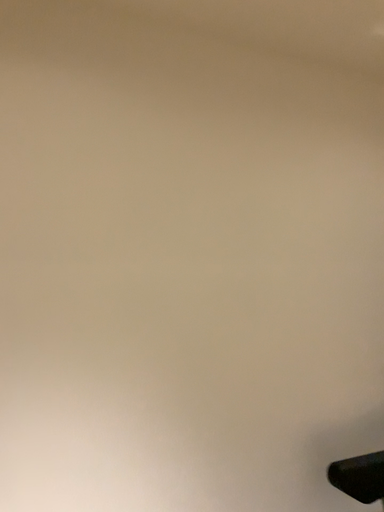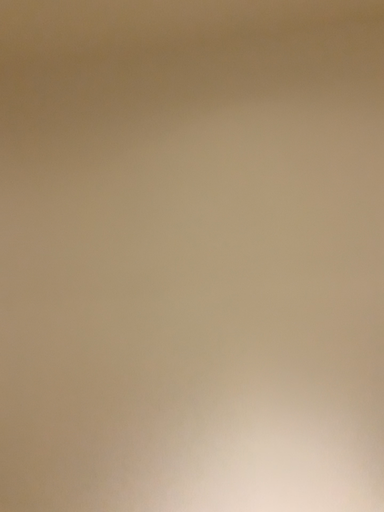
Question: How did the camera likely rotate when shooting the video?

Choices:
 (A) rotated left
 (B) rotated right

Answer: (A)